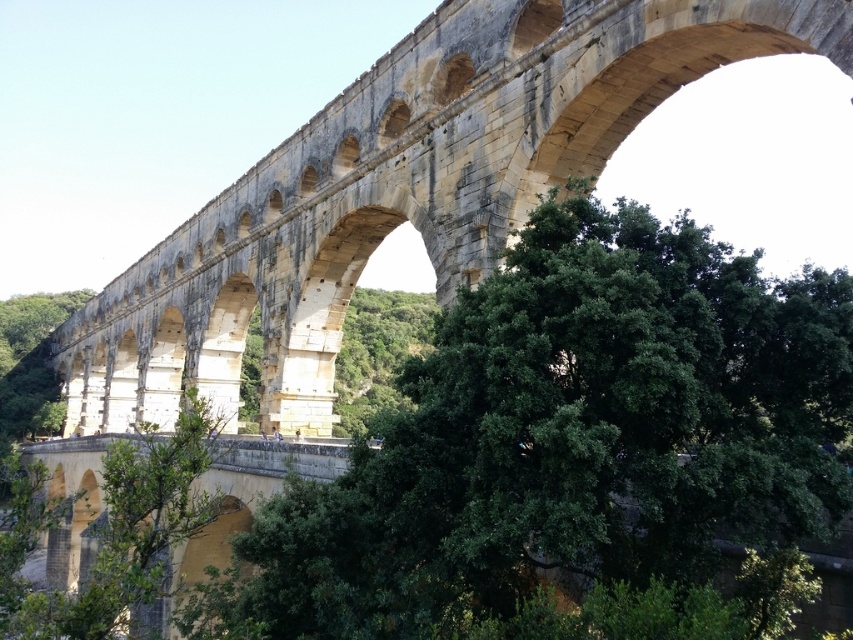
Question: Does green leafy tree at center appear over stone arch bridge at center?

Choices:
 (A) no
 (B) yes

Answer: (A)

Question: Does green leafy tree at center appear on the right side of stone arch bridge at center?

Choices:
 (A) no
 (B) yes

Answer: (B)

Question: Among these points, which one is farthest from the camera?

Choices:
 (A) (630, 394)
 (B) (90, 356)

Answer: (B)

Question: Is green leafy tree at center to the left of stone arch bridge at center from the viewer's perspective?

Choices:
 (A) yes
 (B) no

Answer: (B)